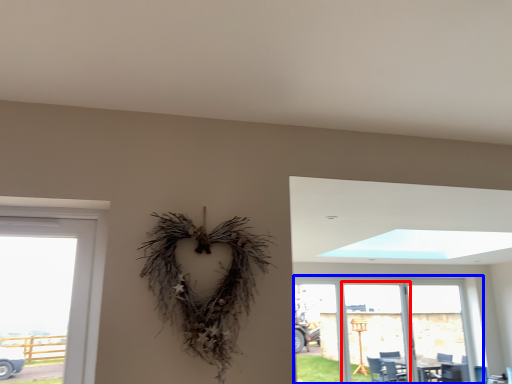
Question: Which of the following is the farthest to the observer, screen door (highlighted by a red box) or window (highlighted by a blue box)?

Choices:
 (A) screen door
 (B) window

Answer: (A)